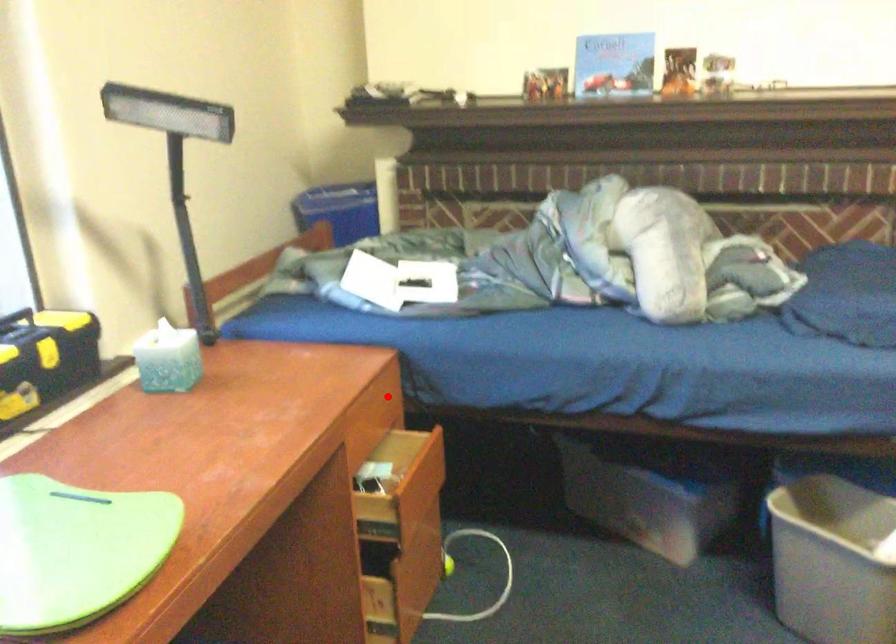
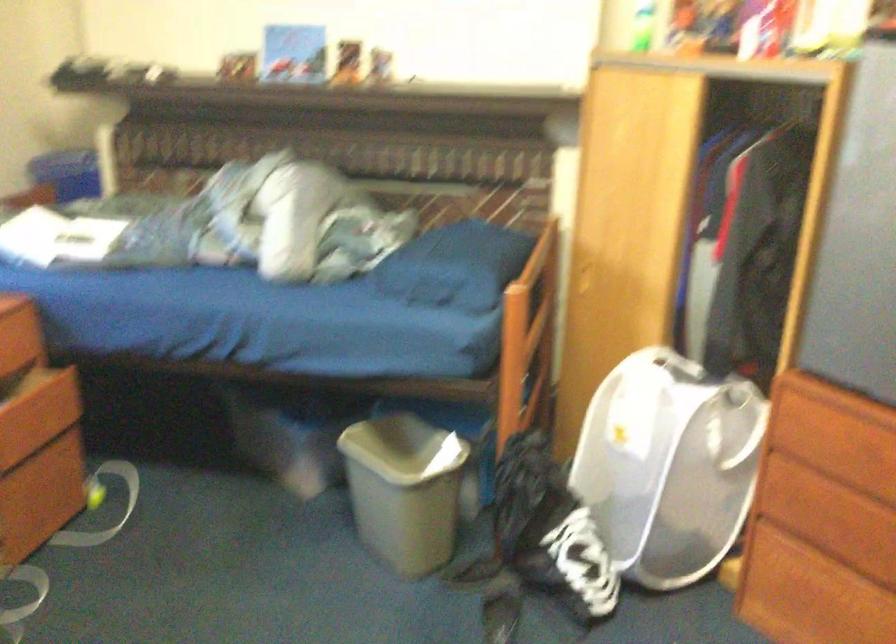
Where in the second image is the point corresponding to the highlighted location from the first image?

(19, 332)